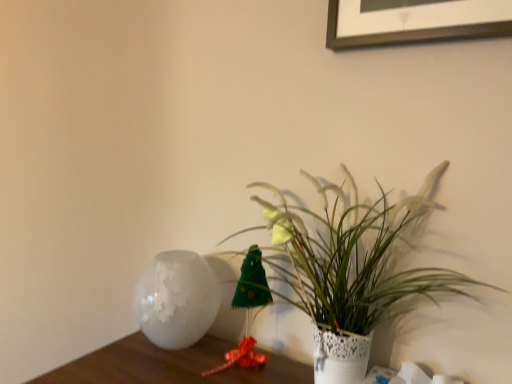
Question: From a real-world perspective, is white textured vase at center over white frosted vase at left?

Choices:
 (A) yes
 (B) no

Answer: (A)

Question: Does white textured vase at center have a greater width compared to white frosted vase at left?

Choices:
 (A) no
 (B) yes

Answer: (A)

Question: Can you confirm if white textured vase at center is bigger than white frosted vase at left?

Choices:
 (A) yes
 (B) no

Answer: (A)

Question: Can you see white textured vase at center touching white frosted vase at left?

Choices:
 (A) no
 (B) yes

Answer: (A)

Question: Is white textured vase at center not within white frosted vase at left?

Choices:
 (A) yes
 (B) no

Answer: (A)

Question: Is white textured vase at center positioned far away from white frosted vase at left?

Choices:
 (A) yes
 (B) no

Answer: (B)

Question: Is white frosted vase at left in contact with white textured vase at center?

Choices:
 (A) no
 (B) yes

Answer: (A)

Question: Is white frosted vase at left behind white textured vase at center?

Choices:
 (A) yes
 (B) no

Answer: (A)

Question: From a real-world perspective, does white frosted vase at left sit lower than white textured vase at center?

Choices:
 (A) yes
 (B) no

Answer: (A)

Question: Is white frosted vase at left not near white textured vase at center?

Choices:
 (A) yes
 (B) no

Answer: (B)

Question: Is white frosted vase at left positioned with its back to white textured vase at center?

Choices:
 (A) yes
 (B) no

Answer: (B)

Question: Is white frosted vase at left wider than white textured vase at center?

Choices:
 (A) no
 (B) yes

Answer: (B)

Question: From the image's perspective, is white frosted vase at left located above or below white textured vase at center?

Choices:
 (A) above
 (B) below

Answer: (B)